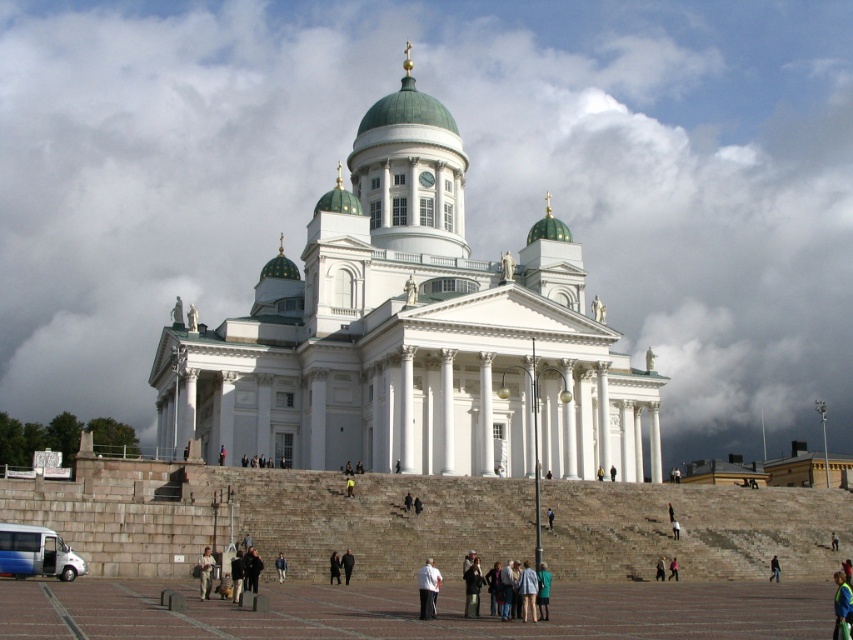
You are standing at the base of the cathedral stairs and want to reach the entrance. There are two points marked on the ground in front of you. The first is point (x=233, y=573) and the second is point (x=676, y=573). Which point is closer to the entrance?

Point (x=233, y=573) is in front of point (x=676, y=573), so it is closer to the entrance.

You are standing at the base of the cathedral steps and see the point marked as point (251, 568). Which direction should you walk to reach the dark blue jacket at center?

The dark blue jacket at center is represented by point (251, 568), so you should walk towards the center of the scene to reach it.